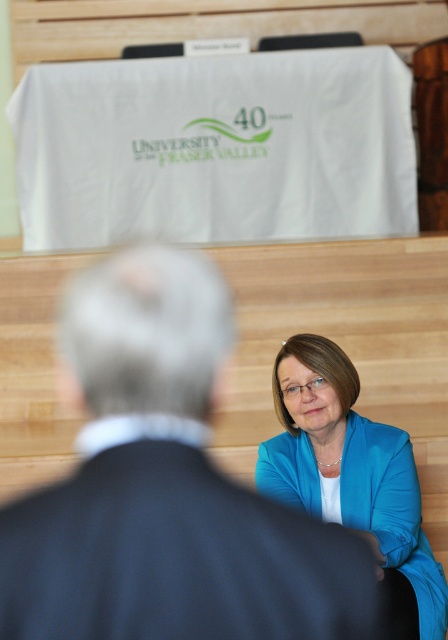
Question: Is the position of dark blue suit at center less distant than that of blue fabric jacket at lower right?

Choices:
 (A) yes
 (B) no

Answer: (A)

Question: Which point is closer to the camera taking this photo?

Choices:
 (A) (335, 492)
 (B) (185, 426)

Answer: (B)

Question: Does dark blue suit at center have a larger size compared to blue fabric jacket at lower right?

Choices:
 (A) yes
 (B) no

Answer: (B)

Question: Which point is farther to the camera?

Choices:
 (A) (356, 486)
 (B) (356, 616)

Answer: (A)

Question: Is dark blue suit at center smaller than blue fabric jacket at lower right?

Choices:
 (A) no
 (B) yes

Answer: (B)